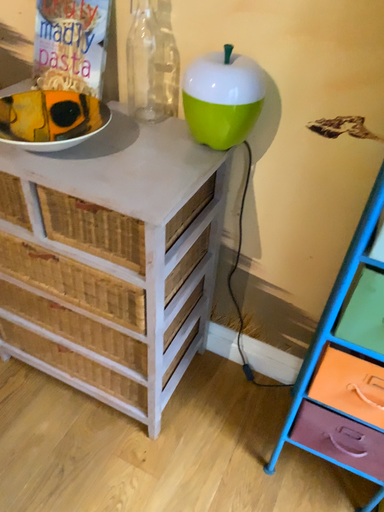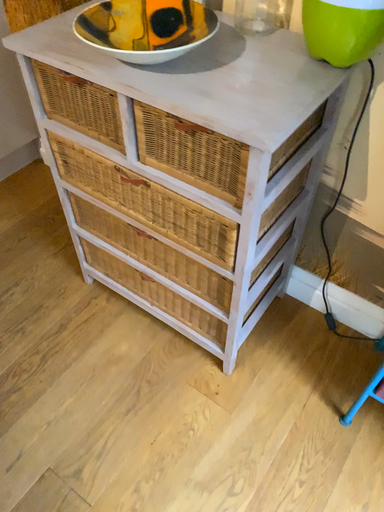
Question: How did the camera likely rotate when shooting the video?

Choices:
 (A) rotated left
 (B) rotated right

Answer: (A)